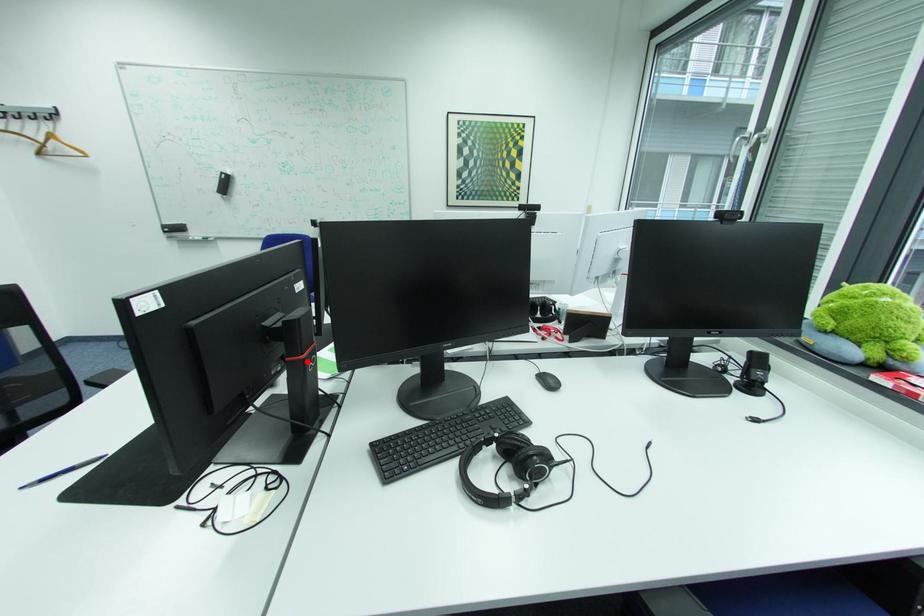
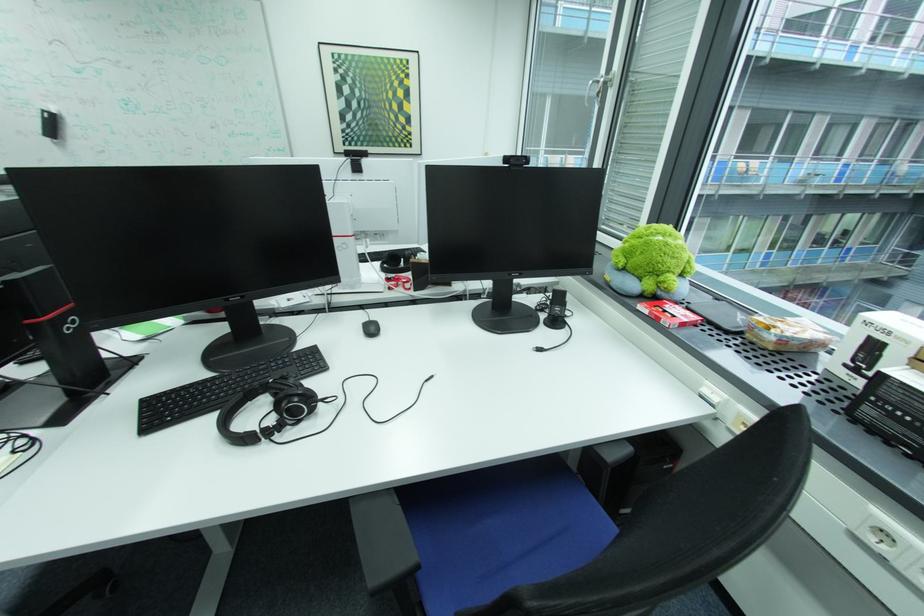
Question: I am providing you with two images of the same scene from different viewpoints. Image1 has a red point marked. In image2, the corresponding 3D location appears at what relative position? Reply with the corresponding letter.

Choices:
 (A) Closer
 (B) Farther

Answer: (B)